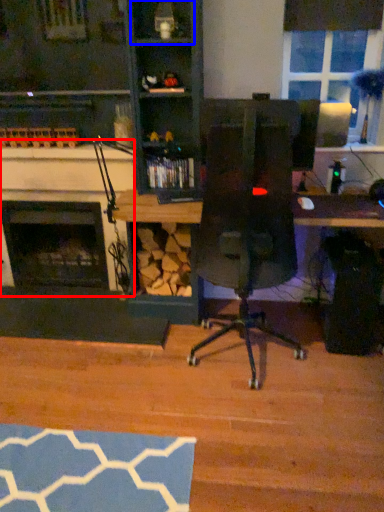
Question: Which object is closer to the camera taking this photo, fireplace (highlighted by a red box) or shelf (highlighted by a blue box)?

Choices:
 (A) fireplace
 (B) shelf

Answer: (B)